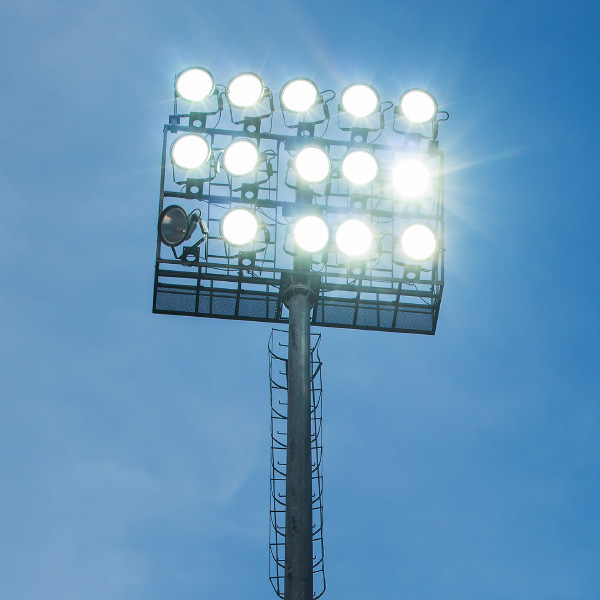
Locate an element on the screen. This screenshot has width=600, height=600. lights on bottom row is located at coordinates (175, 222), (235, 229), (304, 231), (351, 234), (417, 238).